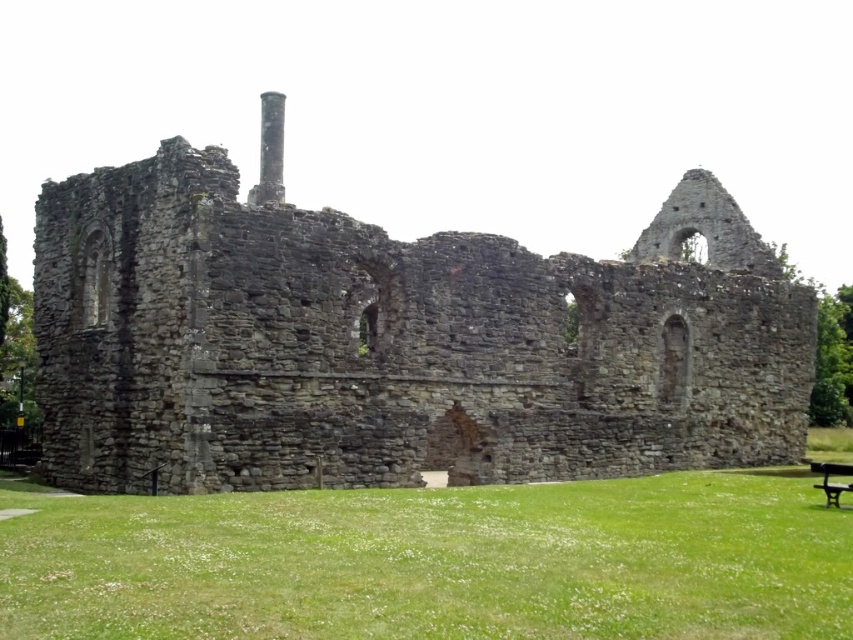
You are standing on the lawn in front of the stone ruins. You notice a specific point marked at coordinates [393,340]. What does this point indicate?

The point at coordinates [393,340] indicates the location of the rusty stone ruins at center.

You are standing at the edge of the ruins and want to sit down. There is a green grass at lower center and a black wooden bench at lower right. Which one is nearer to you?

The green grass at lower center is closer to the viewer than the black wooden bench at lower right, so the green grass at lower center is nearer to you.

You are a visitor standing at the entrance of the ruins and want to sit down. There is a green grass at lower center and a black wooden bench at lower right. Which one is higher up from the ground?

The green grass at lower center is above the black wooden bench at lower right, so the green grass at lower center is higher up from the ground.